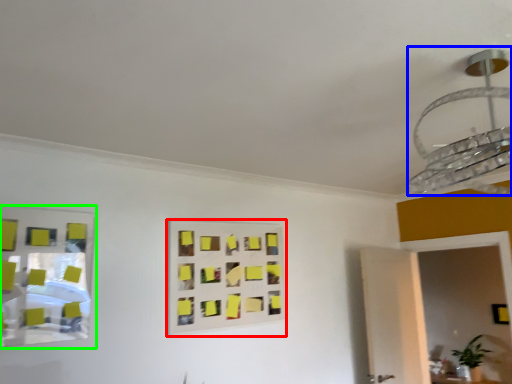
Question: Which is nearer to the rectangle (highlighted by a red box)? lamp (highlighted by a blue box) or mirror (highlighted by a green box).

Choices:
 (A) lamp
 (B) mirror

Answer: (B)